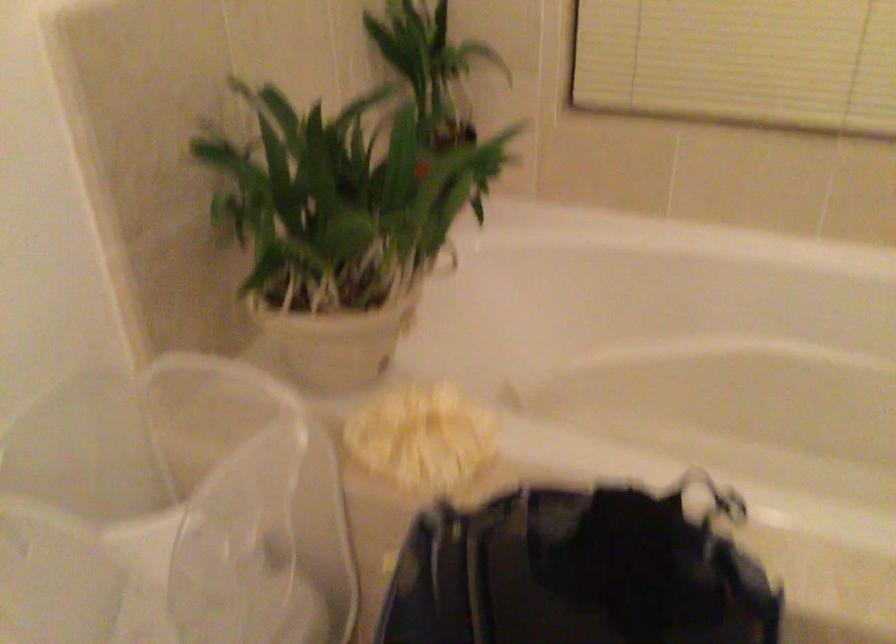
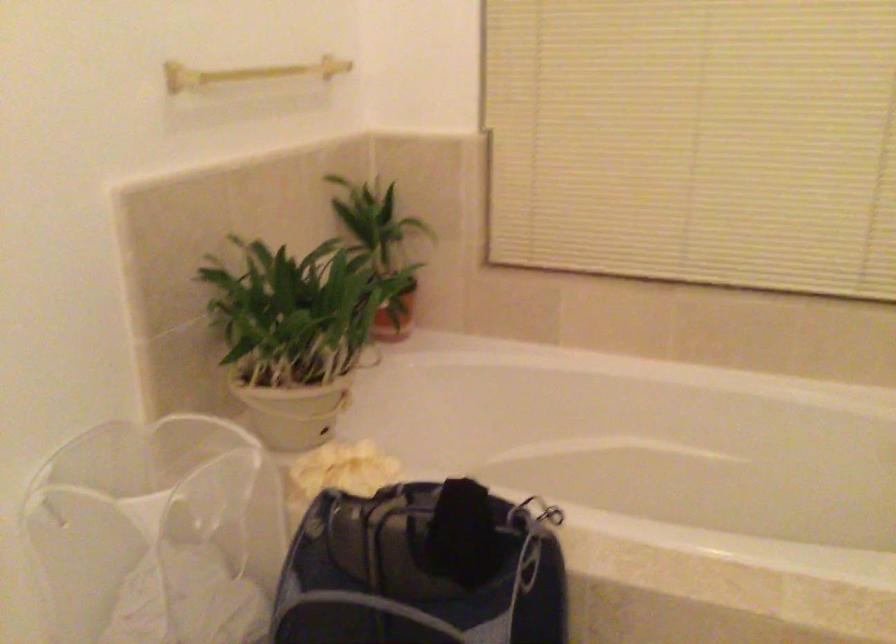
Locate, in the second image, the point that corresponds to point (474, 205) in the first image.

(394, 317)